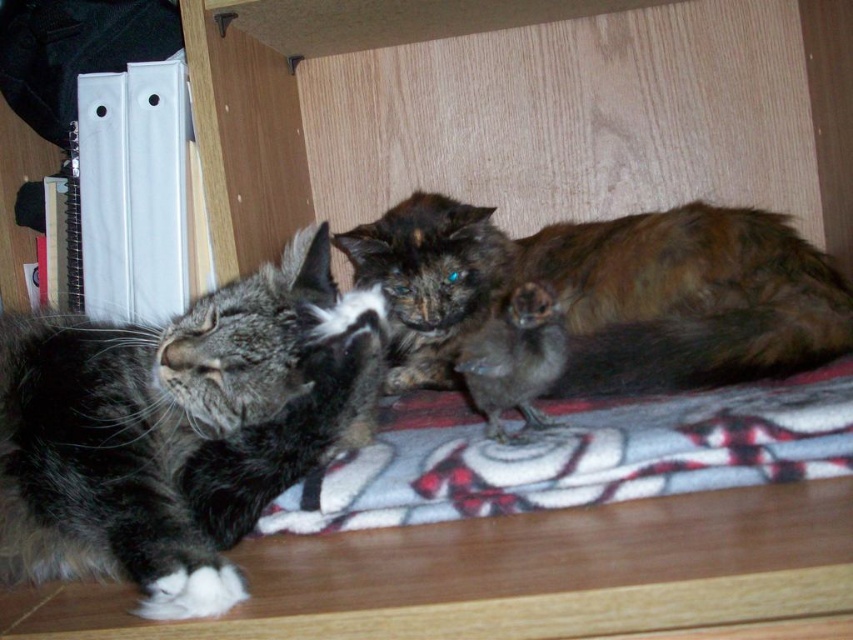
Question: Does gray fluffy cat at left appear over fluffy brown cat at center?

Choices:
 (A) no
 (B) yes

Answer: (A)

Question: Where is gray fluffy cat at left located in relation to fluffy brown cat at center in the image?

Choices:
 (A) above
 (B) below

Answer: (B)

Question: Which of the following is the farthest from the observer?

Choices:
 (A) (337, 355)
 (B) (669, 476)

Answer: (A)

Question: Which object appears farthest from the camera in this image?

Choices:
 (A) plaid fleece blanket at center
 (B) gray fluffy cat at left

Answer: (A)

Question: Does gray fluffy cat at left come in front of fluffy brown cat at center?

Choices:
 (A) no
 (B) yes

Answer: (B)

Question: Which of the following is the closest to the observer?

Choices:
 (A) fluffy brown cat at center
 (B) plaid fleece blanket at center

Answer: (B)